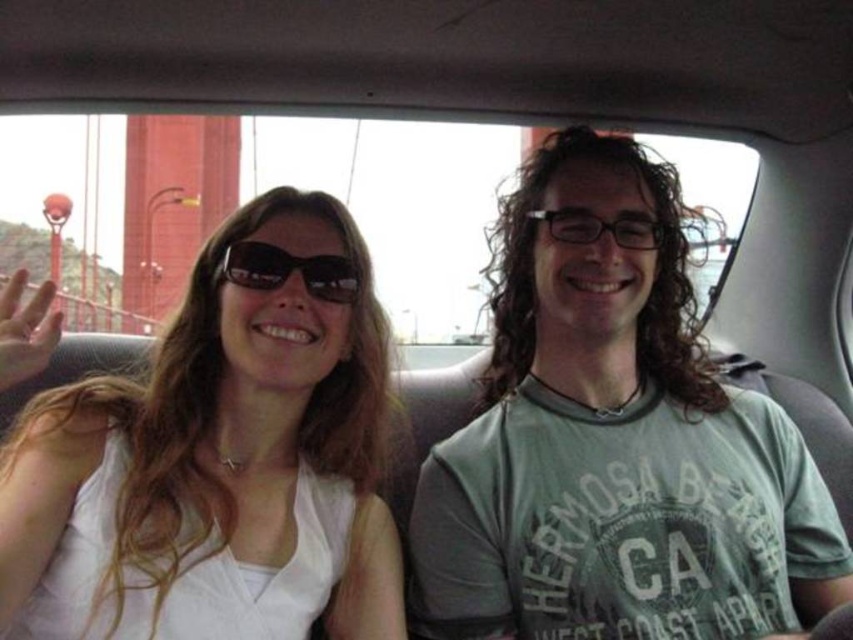
Question: Can you confirm if green cotton t-shirt at center is bigger than black plastic sunglasses at upper center?

Choices:
 (A) no
 (B) yes

Answer: (B)

Question: Estimate the real-world distances between objects in this image. Which object is closer to the green cotton t-shirt at center?

Choices:
 (A) transparent plastic glasses at center
 (B) white fabric shirt at left
 (C) black plastic sunglasses at upper center

Answer: (A)

Question: Which point is farther to the camera?

Choices:
 (A) (254, 257)
 (B) (54, 564)
 (C) (753, 493)
 (D) (601, 224)

Answer: (D)

Question: Can you confirm if green cotton t-shirt at center is positioned above white fabric shirt at left?

Choices:
 (A) yes
 (B) no

Answer: (A)

Question: Which of the following is the farthest from the observer?

Choices:
 (A) white fabric shirt at left
 (B) black plastic sunglasses at upper center
 (C) transparent plastic glasses at center

Answer: (C)

Question: Can you confirm if green cotton t-shirt at center is thinner than transparent plastic glasses at center?

Choices:
 (A) yes
 (B) no

Answer: (B)